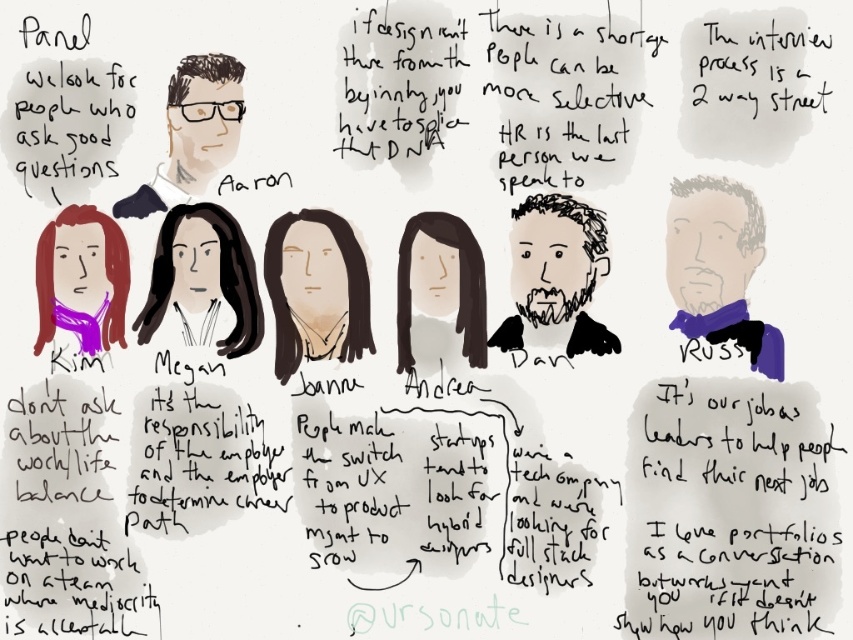
Question: Is matte black hair at center wider than matte black glasses at upper center?

Choices:
 (A) no
 (B) yes

Answer: (A)

Question: Which object appears closest to the camera in this image?

Choices:
 (A) purple scarf at lower left
 (B) brown matte hair at center
 (C) matte black hair at center
 (D) bearded man at center

Answer: (A)

Question: Is bearded man at center above brown matte hair at center?

Choices:
 (A) no
 (B) yes

Answer: (B)

Question: Which object appears farthest from the camera in this image?

Choices:
 (A) matte black hair at center
 (B) brown matte hair at center
 (C) bearded man at center
 (D) white paper at lower right

Answer: (A)

Question: Which of the following is the closest to the observer?

Choices:
 (A) matte black glasses at upper center
 (B) bearded man at center
 (C) white paper at lower right
 (D) smooth black hair at center

Answer: (C)

Question: Does smooth black hair at center appear under bearded man at center?

Choices:
 (A) yes
 (B) no

Answer: (A)